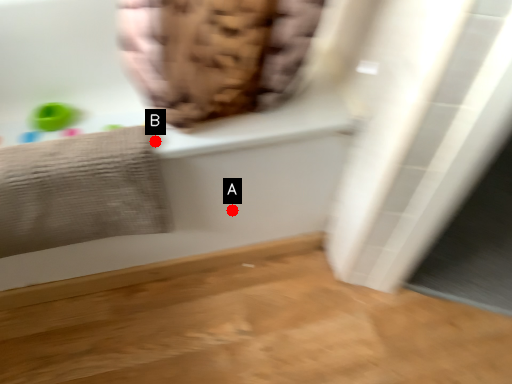
Question: Two points are circled on the image, labeled by A and B beside each circle. Which point is closer to the camera taking this photo?

Choices:
 (A) A is closer
 (B) B is closer

Answer: (B)